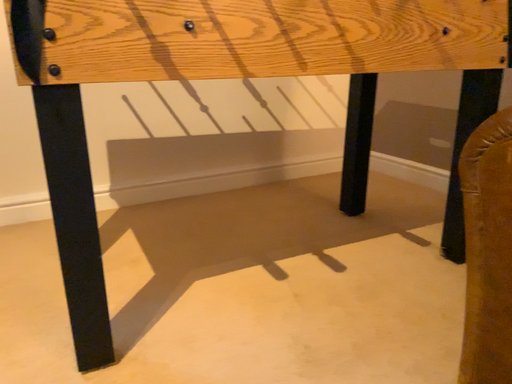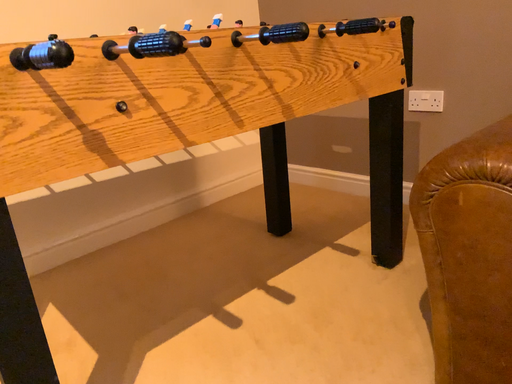
Question: Which way did the camera rotate in the video?

Choices:
 (A) rotated right
 (B) rotated left

Answer: (A)